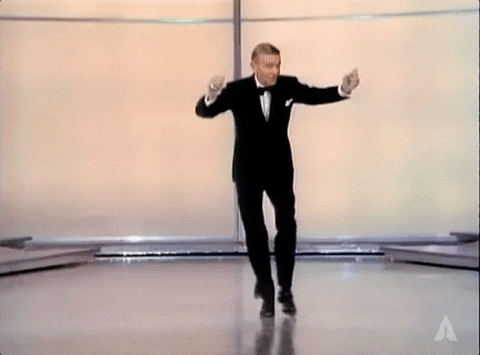
The width and height of the screenshot is (480, 355). What are the coordinates of `dance floor` in the screenshot? It's located at (364, 294).